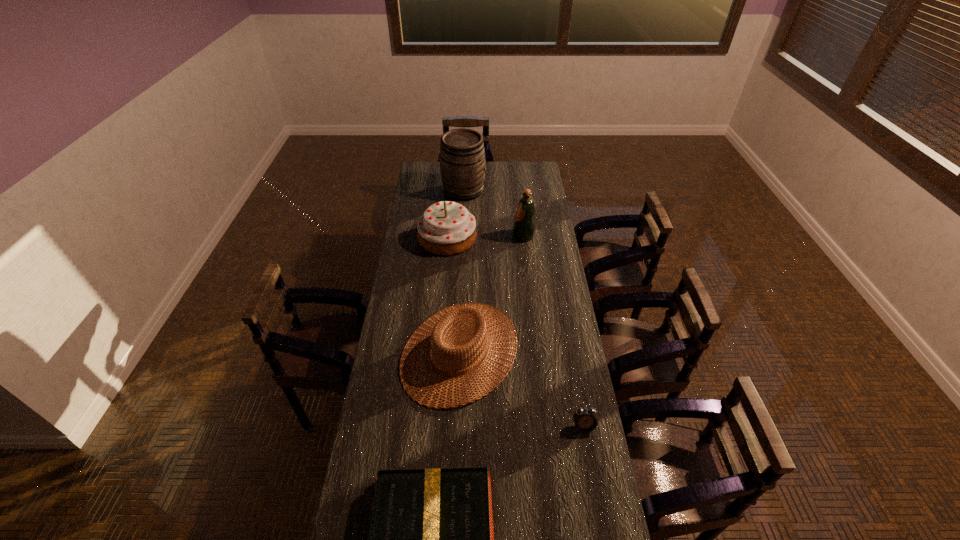
Image resolution: width=960 pixels, height=540 pixels. Identify the location of olive oil located in the right edge section of the desktop. (524, 224).

Locate an element on the screen. This screenshot has width=960, height=540. alarm clock at the right edge is located at coordinates (585, 420).

Image resolution: width=960 pixels, height=540 pixels. Identify the location of object located at the far left corner. (462, 156).

This screenshot has height=540, width=960. In the image, there is a desktop. What are the coordinates of `free space at the left edge` in the screenshot? It's located at (428, 309).

The height and width of the screenshot is (540, 960). Identify the location of vacant region at the right edge of the desktop. (564, 342).

At what (x,y) coordinates should I click in order to perform the action: click on vacant space at the far right corner. Please return your answer as a coordinate pair (x, y). The height and width of the screenshot is (540, 960). Looking at the image, I should click on (533, 171).

Find the location of a particular element. The image size is (960, 540). unoccupied position between the tallest object and the fourth tallest object is located at coordinates (462, 271).

Identify the location of free space between the olive oil and the rightmost object. The height and width of the screenshot is (540, 960). (553, 331).

Locate an element on the screen. free point between the sunhat and the rightmost object is located at coordinates (521, 389).

At what (x,y) coordinates should I click in order to perform the action: click on vacant area that lies between the wine bucket and the rightmost object. Please return your answer as a coordinate pair (x, y). The image size is (960, 540). Looking at the image, I should click on (523, 308).